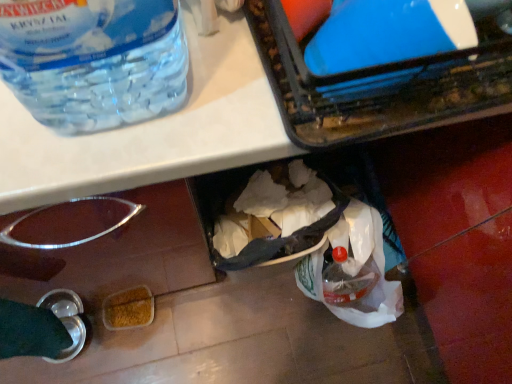
Question: From a real-world perspective, does blue glossy plastic container at upper right sit lower than transparent plastic bottle at upper left?

Choices:
 (A) no
 (B) yes

Answer: (A)

Question: Would you say blue glossy plastic container at upper right is outside transparent plastic bottle at upper left?

Choices:
 (A) no
 (B) yes

Answer: (B)

Question: Is blue glossy plastic container at upper right in front of transparent plastic bottle at upper left?

Choices:
 (A) yes
 (B) no

Answer: (B)

Question: Can you confirm if blue glossy plastic container at upper right is wider than transparent plastic bottle at upper left?

Choices:
 (A) yes
 (B) no

Answer: (B)

Question: Is blue glossy plastic container at upper right facing towards transparent plastic bottle at upper left?

Choices:
 (A) yes
 (B) no

Answer: (B)

Question: Is blue glossy plastic container at upper right smaller than transparent plastic bottle at upper left?

Choices:
 (A) yes
 (B) no

Answer: (A)

Question: Is transparent plastic bottle at upper left to the left of blue glossy plastic container at upper right from the viewer's perspective?

Choices:
 (A) no
 (B) yes

Answer: (B)

Question: Is transparent plastic bottle at upper left to the right of blue glossy plastic container at upper right from the viewer's perspective?

Choices:
 (A) no
 (B) yes

Answer: (A)

Question: Is transparent plastic bottle at upper left facing away from blue glossy plastic container at upper right?

Choices:
 (A) no
 (B) yes

Answer: (A)

Question: Are transparent plastic bottle at upper left and blue glossy plastic container at upper right beside each other?

Choices:
 (A) no
 (B) yes

Answer: (A)

Question: From the image's perspective, is transparent plastic bottle at upper left beneath blue glossy plastic container at upper right?

Choices:
 (A) yes
 (B) no

Answer: (B)

Question: From a real-world perspective, does transparent plastic bottle at upper left stand above blue glossy plastic container at upper right?

Choices:
 (A) no
 (B) yes

Answer: (A)

Question: From the image's perspective, is blue glossy plastic container at upper right above or below transparent plastic bottle at upper left?

Choices:
 (A) below
 (B) above

Answer: (A)